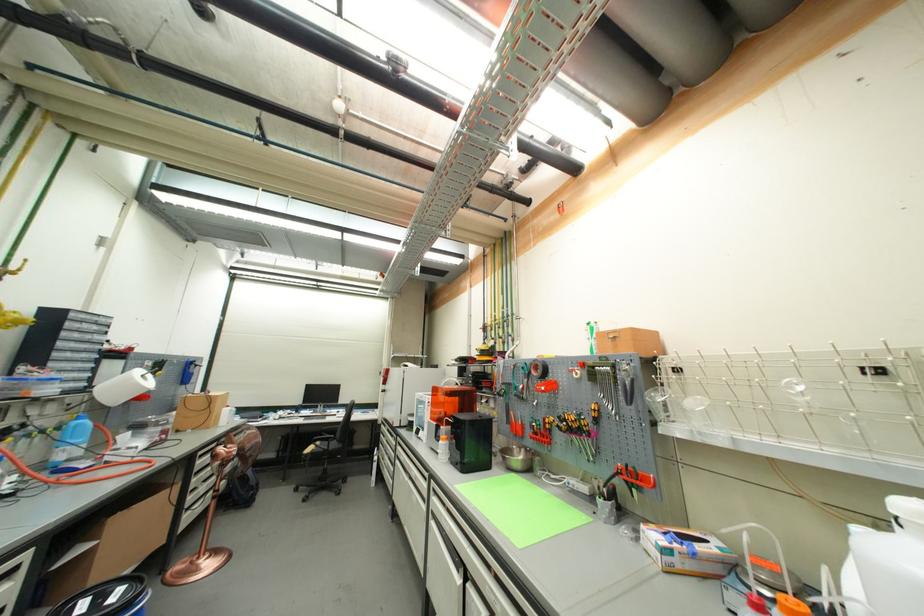
The image size is (924, 616). What do you see at coordinates (586, 427) in the screenshot?
I see `a yellow screwdriver handle` at bounding box center [586, 427].